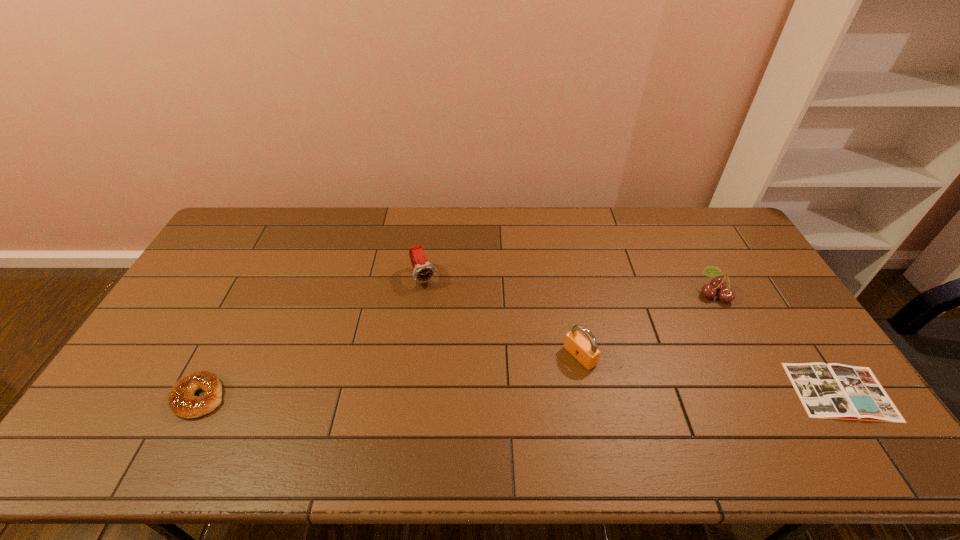
I want to click on the leftmost object, so (x=182, y=401).

I want to click on the second shortest object, so click(x=182, y=401).

You are a GUI agent. You are given a task and a screenshot of the screen. Output one action in this format:
    pyautogui.click(x=<x>, y=<y>)
    Task: Click on the book
    The height and width of the screenshot is (540, 960).
    Given the screenshot: What is the action you would take?
    pyautogui.click(x=830, y=391)

Find the location of a particular element. This screenshot has width=960, height=540. the rightmost object is located at coordinates (830, 391).

The height and width of the screenshot is (540, 960). I want to click on padlock, so click(x=586, y=352).

Locate an element on the screen. watch is located at coordinates (423, 271).

Where is `the fourth object from left to right`? The width and height of the screenshot is (960, 540). the fourth object from left to right is located at coordinates (718, 284).

You are a GUI agent. You are given a task and a screenshot of the screen. Output one action in this format:
    pyautogui.click(x=<x>, y=<y>)
    Task: Click on the third shortest object
    This screenshot has width=960, height=540.
    Given the screenshot: What is the action you would take?
    pyautogui.click(x=718, y=284)

Find the location of a particular element. The width and height of the screenshot is (960, 540). free space located on the back of the leftmost object is located at coordinates (246, 307).

Find the location of a particular element. vacant space located 0.180m on the left of the shortest object is located at coordinates (726, 392).